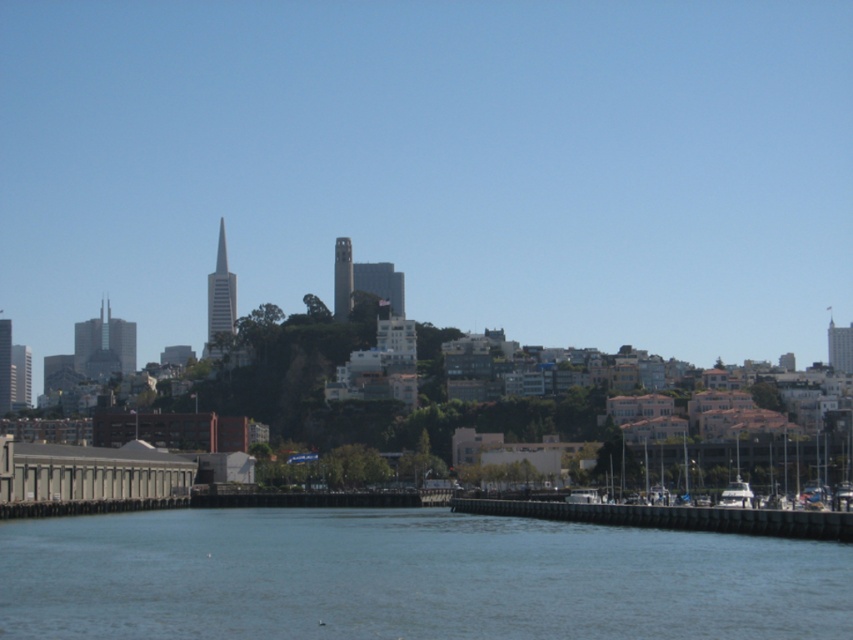
You are standing on the brown wooden dock at lower center and want to see the blue water at center. In which direction should you look?

The blue water at center is above the brown wooden dock at lower center, so you should look upward to see the blue water at center.

You are a photographer planning to capture the entire cityscape in one shot. Given that your camera can only fit objects with a combined width of 10 meters, and you need to include both the blue water at center and the brown wooden dock at lower center, will you be able to capture both in a single frame?

The blue water at center is wider than the brown wooden dock at lower center. Since the combined width of both objects would exceed 10 meters, it is unlikely that both can fit in a single frame.

You are standing on the brown wooden dock at lower center and want to throw a stone into the blue water at center. Considering their positions, will the stone land in the water?

The blue water at center is closer to the viewer than the brown wooden dock at lower center. Since you are already on the dock, the water is in front of you, so throwing the stone forward would land it in the water.